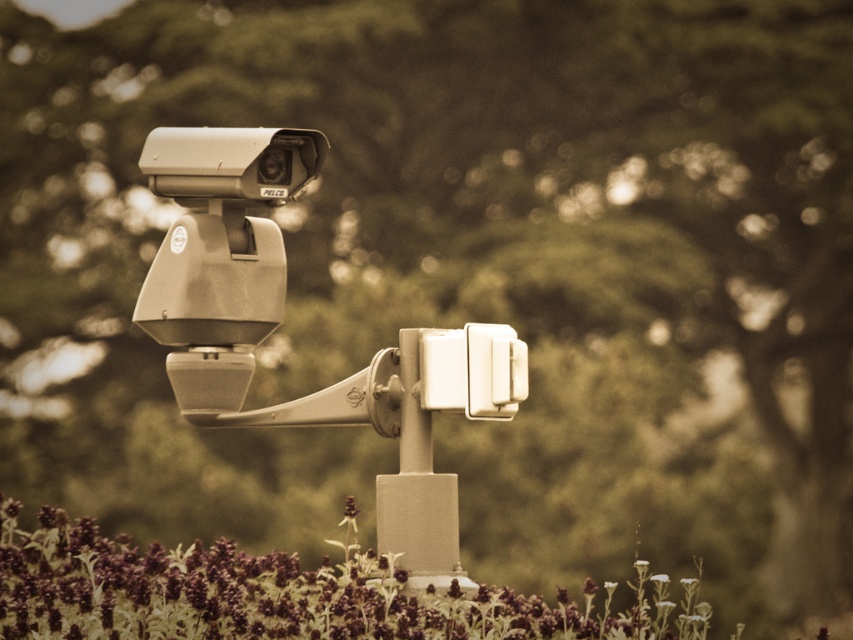
You are a maintenance worker inspecting the security camera setup. You notice the purple matte flowers at lower center and the metallic pole at center. Which object is nearer to you as you approach the scene?

The purple matte flowers at lower center are closer to the viewer than the metallic pole at center, so the flowers are nearer as you approach the scene.

You are standing in front of the security camera and notice two points marked in the scene. Which point is closer to you, point (477, 333) or point (621, 611)?

Point (477, 333) is closer to you because it is further to the viewer than point (621, 611).

You are a technician trying to locate the matte gray security camera at center. According to the coordinates provided, where exactly is it positioned in the image?

The matte gray security camera at center is located at point (281, 317).